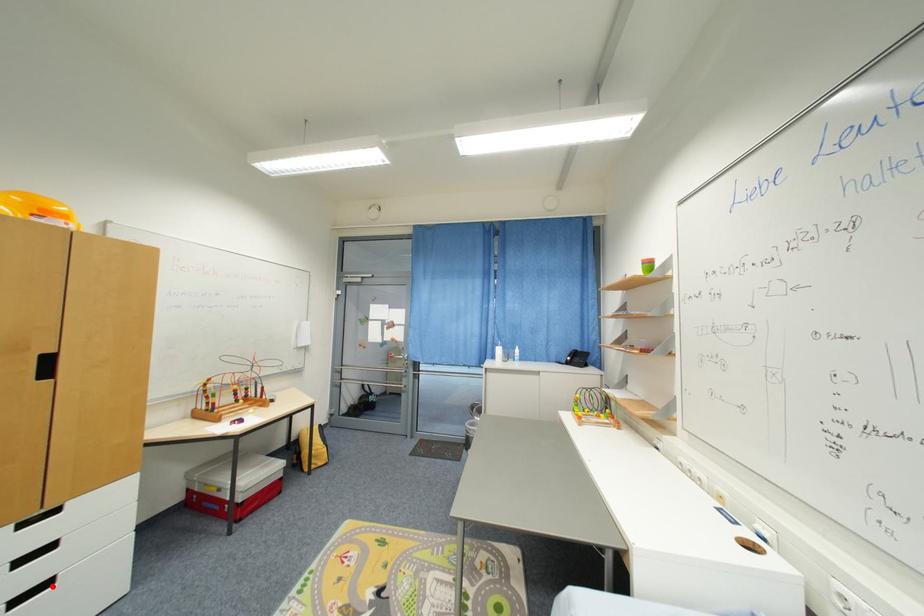
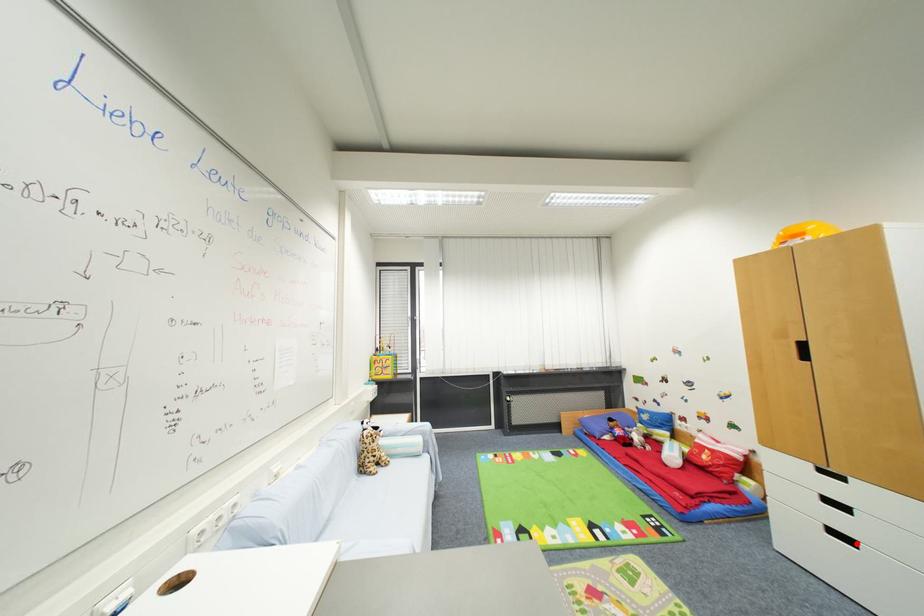
I am providing you with two images of the same scene from different viewpoints. A red point is marked on the first image and another point is marked on the second image. Do the highlighted points in image1 and image2 indicate the same real-world spot?

Yes